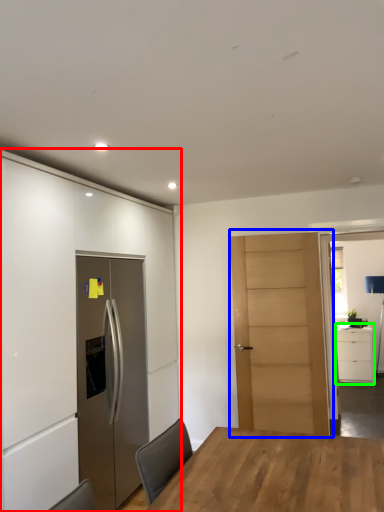
Question: Estimate the real-world distances between objects in this image. Which object is closer to cabinetry (highlighted by a red box), door (highlighted by a blue box) or cabinetry (highlighted by a green box)?

Choices:
 (A) door
 (B) cabinetry

Answer: (A)